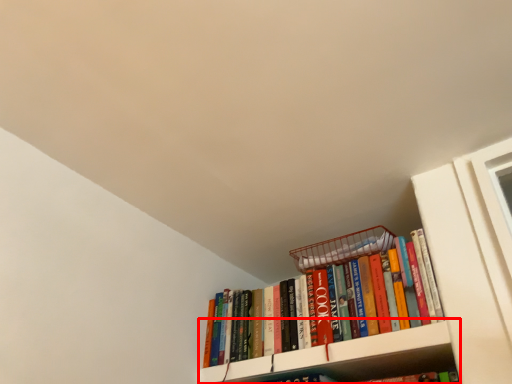
Question: From the image, what is the correct spatial relationship of cabinet (annotated by the red box) in relation to book?

Choices:
 (A) right
 (B) left

Answer: (A)